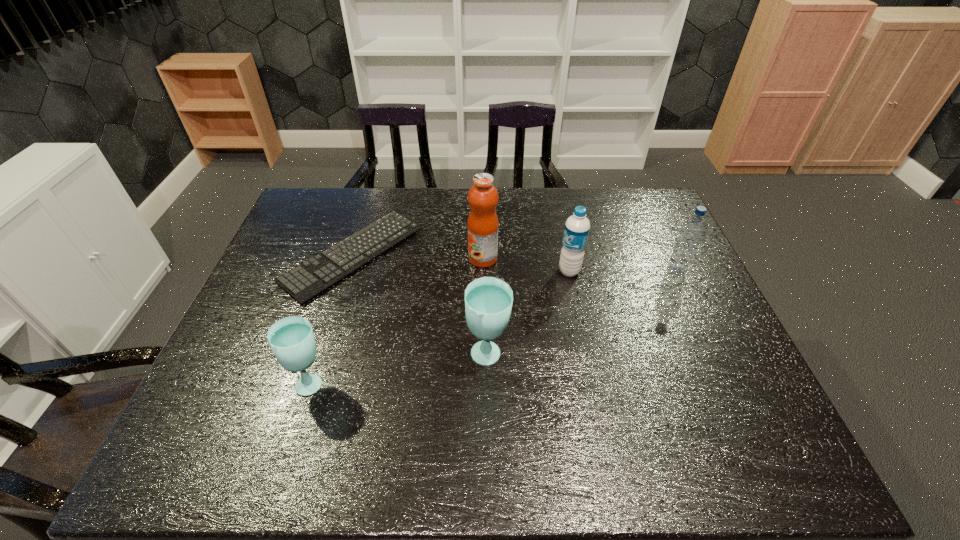
This screenshot has height=540, width=960. Find the location of `vacant space located on the back of the right water bottle`. vacant space located on the back of the right water bottle is located at coordinates (645, 205).

Find the location of a particular element. Image resolution: width=960 pixels, height=540 pixels. vacant area located 0.340m on the label of the second object from right to left is located at coordinates (443, 271).

The height and width of the screenshot is (540, 960). What are the coordinates of `vacant area situated 0.150m on the label of the second object from right to left` in the screenshot? It's located at (507, 271).

The height and width of the screenshot is (540, 960). In order to click on free space located on the label of the second object from right to left in this screenshot , I will do `click(514, 271)`.

I want to click on vacant space located on the front label of the tallest object, so (x=409, y=259).

What are the coordinates of `vacant space situated 0.280m on the front label of the tallest object` in the screenshot? It's located at (376, 259).

Image resolution: width=960 pixels, height=540 pixels. Identify the location of blank space located 0.090m on the front label of the tallest object. (439, 259).

I want to click on object that is at the far edge, so click(303, 282).

Where is `object present at the near edge`? object present at the near edge is located at coordinates (292, 340).

Find the location of `object positioned at the left edge`. object positioned at the left edge is located at coordinates (303, 282).